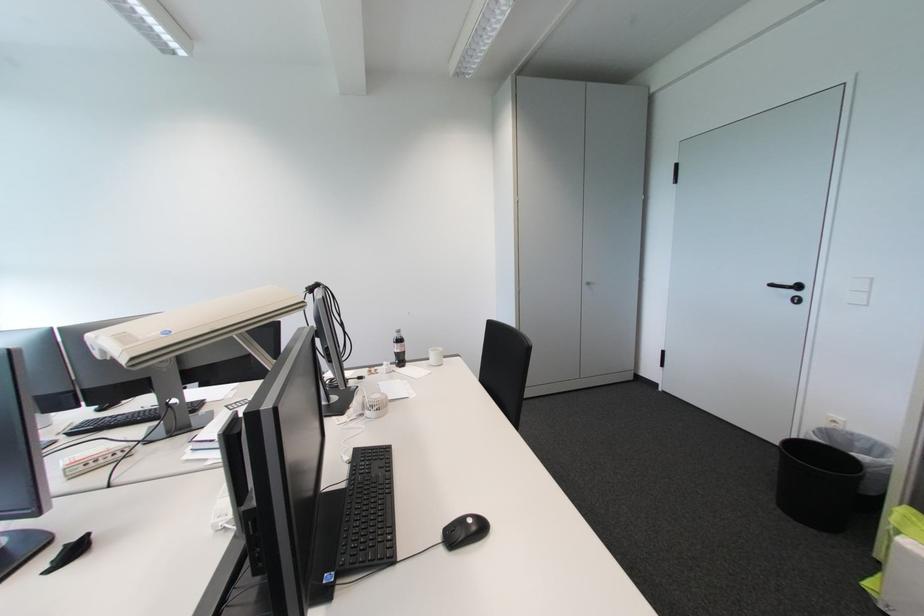
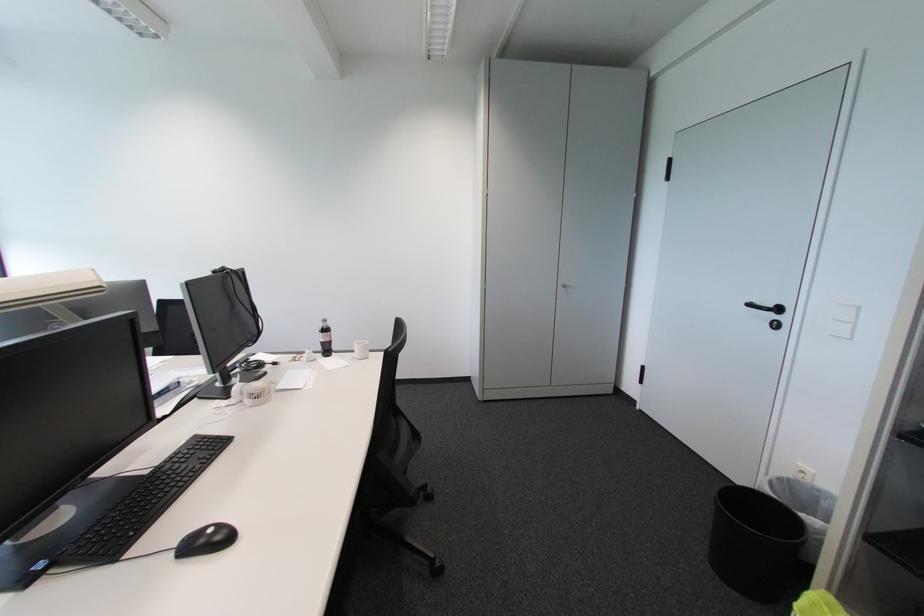
Where in the second image is the point corresponding to point (842, 426) from the first image?

(809, 477)